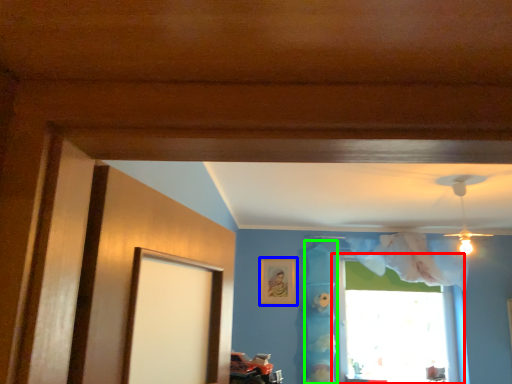
Question: Which object is the farthest from window (highlighted by a red box)? Choose among these: picture frame (highlighted by a blue box) or curtain (highlighted by a green box).

Choices:
 (A) picture frame
 (B) curtain

Answer: (A)